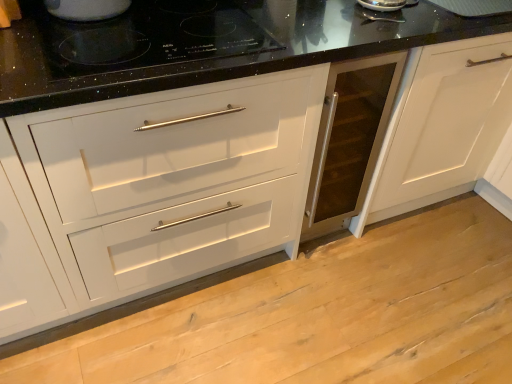
Question: In the image, is white glossy kettle at upper left on the left side or the right side of black glass cooktop at upper center?

Choices:
 (A) right
 (B) left

Answer: (B)

Question: From their relative heights in the image, would you say white glossy kettle at upper left is taller or shorter than black glass cooktop at upper center?

Choices:
 (A) tall
 (B) short

Answer: (A)

Question: From a real-world perspective, is white glossy kettle at upper left above or below black glass cooktop at upper center?

Choices:
 (A) below
 (B) above

Answer: (B)

Question: Is black glass cooktop at upper center inside the boundaries of white glossy kettle at upper left, or outside?

Choices:
 (A) outside
 (B) inside

Answer: (A)

Question: From a real-world perspective, is black glass cooktop at upper center positioned above or below white glossy kettle at upper left?

Choices:
 (A) above
 (B) below

Answer: (B)

Question: Based on their sizes in the image, would you say black glass cooktop at upper center is bigger or smaller than white glossy kettle at upper left?

Choices:
 (A) small
 (B) big

Answer: (B)

Question: From the image's perspective, is black glass cooktop at upper center above or below white glossy kettle at upper left?

Choices:
 (A) above
 (B) below

Answer: (B)